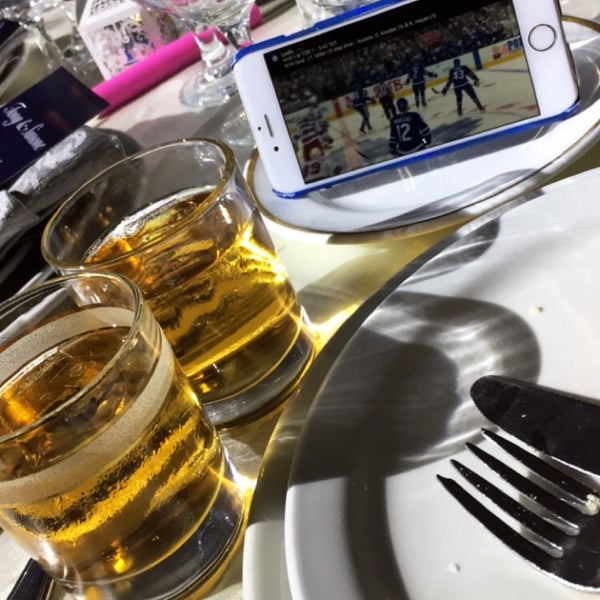
Locate an element on the screen. The image size is (600, 600). glass is located at coordinates (90, 400), (217, 278).